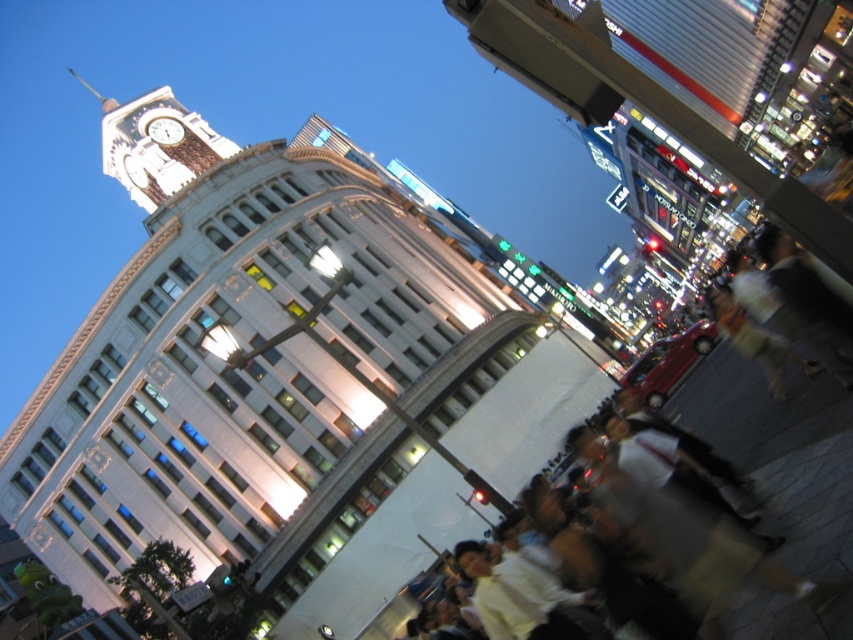
You are standing at the center of the image and want to take a photo of the white stone clock tower at upper left. In which direction should you point your camera?

The white stone clock tower at upper left is located at point (x=154, y=145), so you should point your camera to the upper left direction to capture it.

You are standing in the city square and see two points in the image, one at point (840, 484) and the other at point (163, 99). Which point is nearer to you?

Point (840, 484) is closer to the viewer than point (163, 99).

You are a photographer standing in the crowd at the event. You want to take a photo of the matte white clock at upper left and the light beige shirt at lower right. Which object should you zoom in on to capture more details?

The light beige shirt at lower right is larger in size than the matte white clock at upper left, so you should zoom in on the matte white clock at upper left to capture more details because it is smaller and requires magnification.